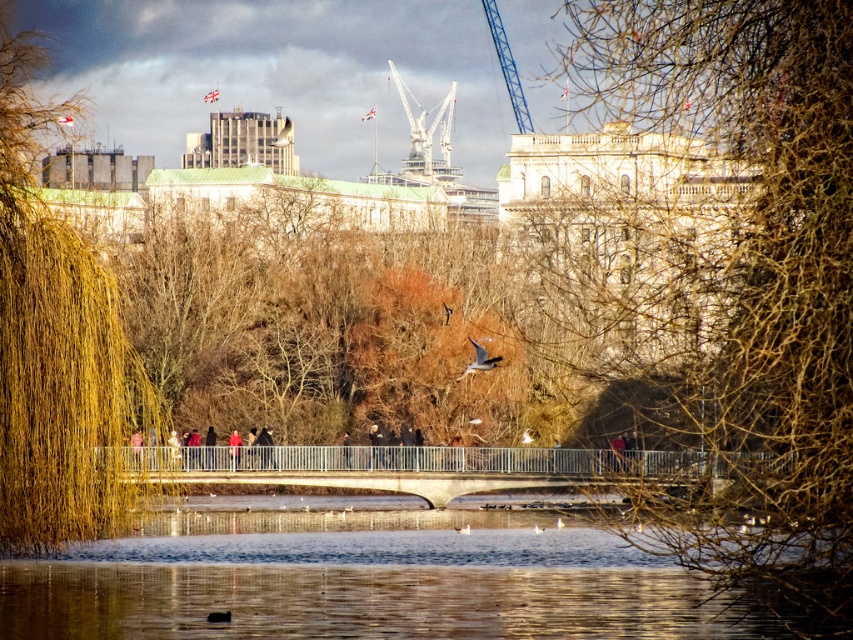
You are standing in the park and want to take a photo of both the point at coordinates point (x=479, y=529) and the point at coordinates point (x=7, y=164). Which point should you focus on first to ensure both are in focus?

You should focus on the point at coordinates point (x=479, y=529) first because it is closer to you than the point at coordinates point (x=7, y=164). This way, both points will be in focus as the camera adjusts the depth of field.